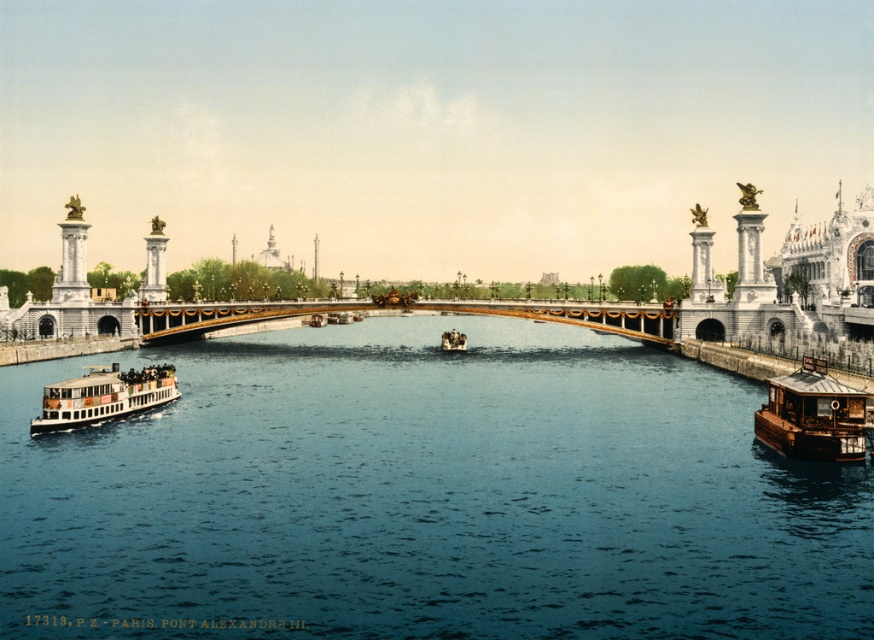
You are standing on the Pont Alexandre III bridge and want to take a photo of the gold polished metal bridge at center and the wooden cabin boat at lower right. Which object appears closer to you in the photo?

The gold polished metal bridge at center appears closer to you in the photo because it is further to the viewer than the wooden cabin boat at lower right.

You are standing on the Pont Alexandre III bridge and looking at two points in the scene. The first point is at coordinates point (649, 321) and the second point is at point (768, 384). Which of these two points is closer to your current position on the bridge?

Point (649, 321) is closer to your current position because it is further to the camera than point (768, 384), meaning it is nearer to the observer standing on the bridge.

You are a tourist standing on the Pont Alexandre III bridge in Paris. You see a white polished wood boat at lower left and a wooden polished boat at center. Which boat is closer to the bridge?

The white polished wood boat at lower left is closer to the bridge because it is located below the wooden polished boat at center, meaning it is positioned closer to the bridge structure.